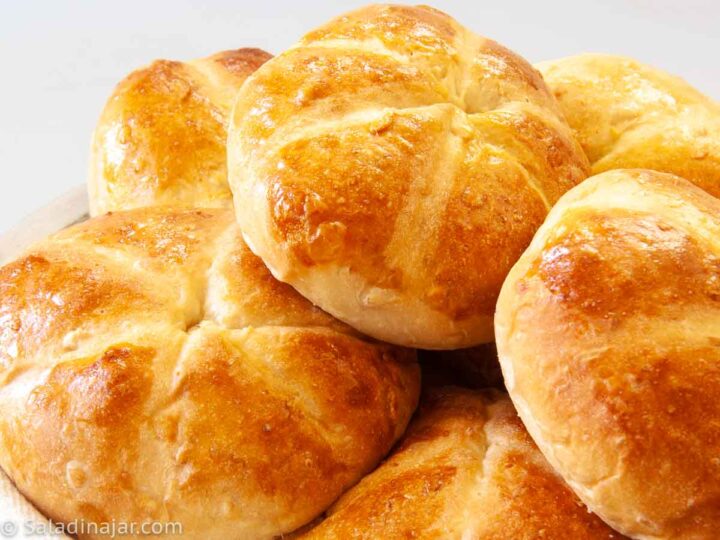
The height and width of the screenshot is (540, 720). I want to click on table, so click(x=55, y=67).